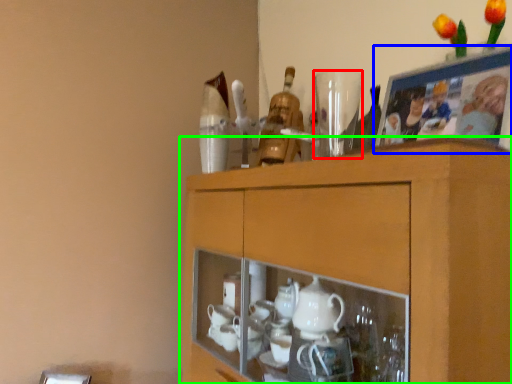
Question: Which object is the closest to the tableware (highlighted by a red box)? Choose among these: picture frame (highlighted by a blue box) or cabinetry (highlighted by a green box).

Choices:
 (A) picture frame
 (B) cabinetry

Answer: (A)